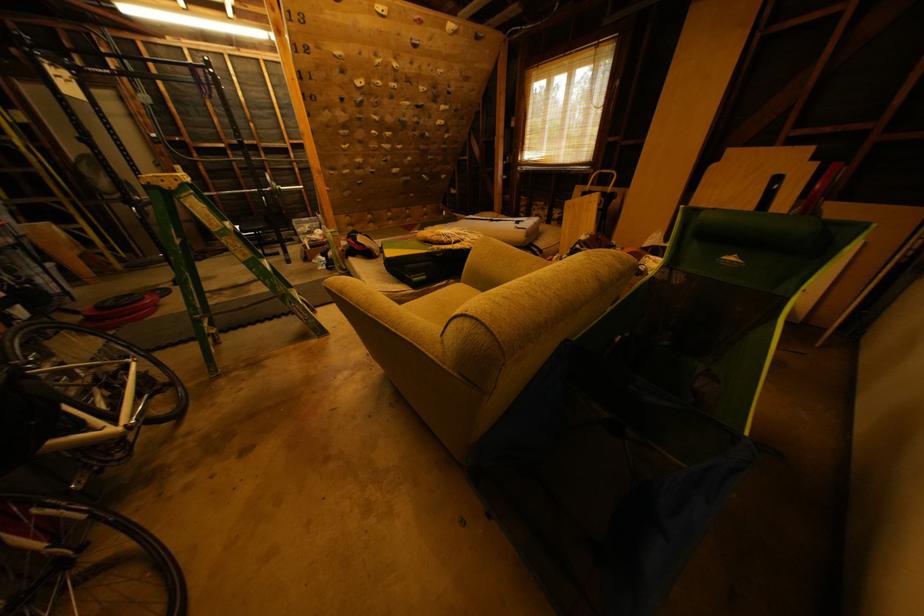
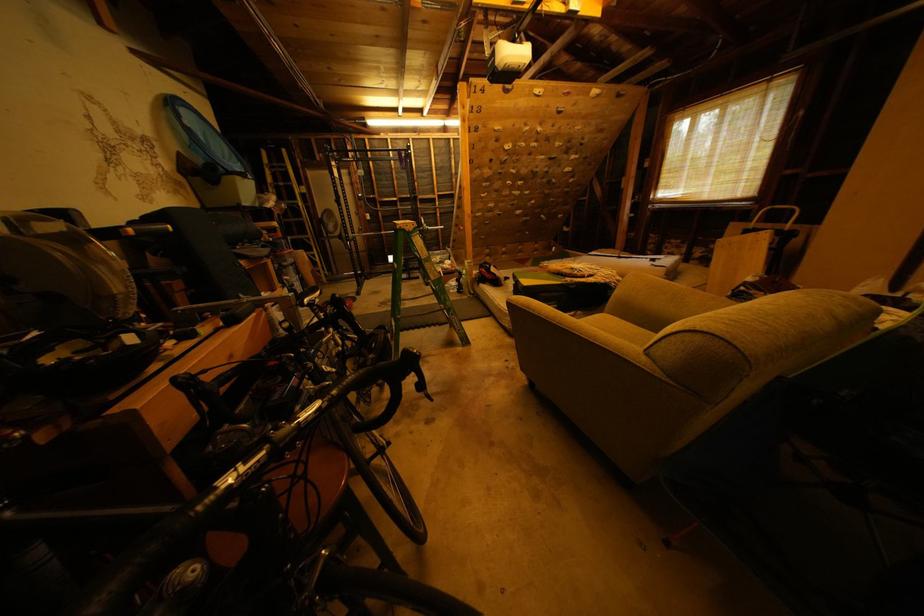
Question: The first image is from the beginning of the video and the second image is from the end. How did the camera likely rotate when shooting the video?

Choices:
 (A) Left
 (B) Right
 (C) Up
 (D) Down

Answer: (A)